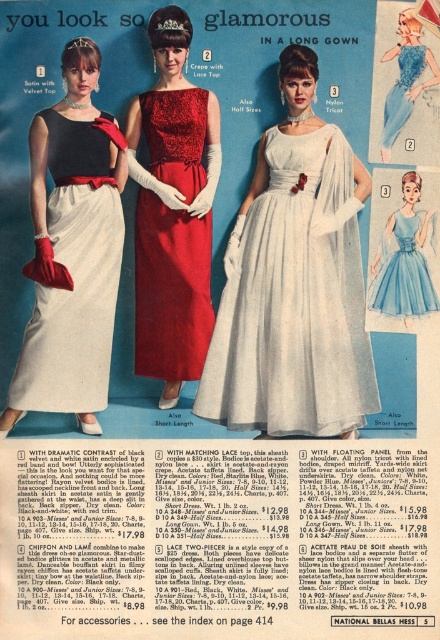
You are a fashion designer analyzing the advertisement. The light blue satin dress at center and the matte nylon dress at center are both displayed in the ad. Which dress is shorter?

The light blue satin dress at center is shorter than the matte nylon dress at center.

In the scene shown: You are a fashion designer analyzing this advertisement. You notice the white nylon dress at center and the matte black velvet top at left. Which one is placed to the right of the other?

A: The white nylon dress at center is positioned on the right side of the matte black velvet top at left.